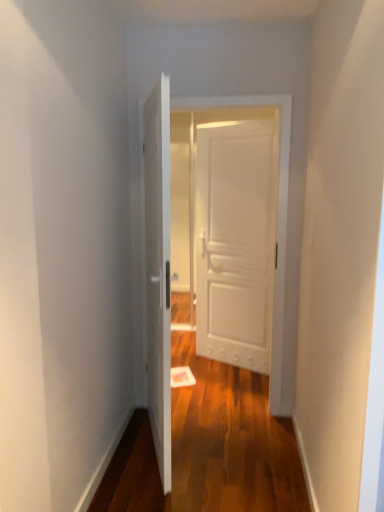
Question: Visually, is white wooden door at center, which appears as the 2th door when viewed from the front, positioned to the left or to the right of white matte door at center, which is the third door from front to back?

Choices:
 (A) left
 (B) right

Answer: (A)

Question: Which is correct: white wooden door at center, the second door from the back, is inside white matte door at center, placed as the first door when sorted from back to front, or outside of it?

Choices:
 (A) inside
 (B) outside

Answer: (B)

Question: Which object is the closest to the white wooden door at center, the second door from the back?

Choices:
 (A) white matte door at center, placed as the first door when sorted from back to front
 (B) white matte door at center, positioned as the first door in front-to-back order

Answer: (B)

Question: Estimate the real-world distances between objects in this image. Which object is farther from the white wooden door at center, the second door from the back?

Choices:
 (A) white matte door at center, placed as the first door when sorted from back to front
 (B) white matte door at center, positioned as the first door in front-to-back order

Answer: (A)